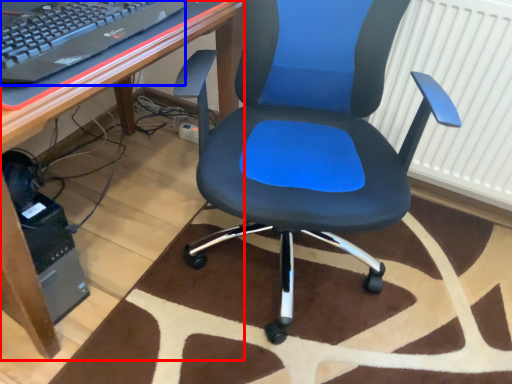
Question: Which object is further to the camera taking this photo, desk (highlighted by a red box) or computer keyboard (highlighted by a blue box)?

Choices:
 (A) desk
 (B) computer keyboard

Answer: (B)